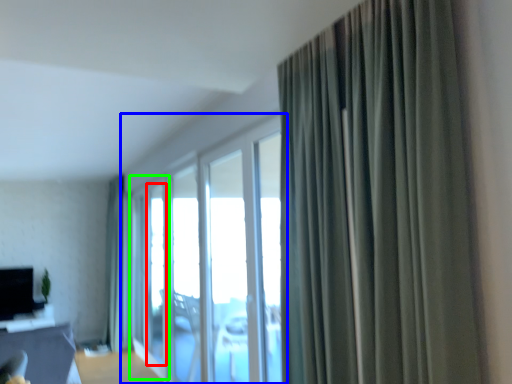
Question: Which object is positioned farthest from window screen (highlighted by a red box)? Select from window (highlighted by a blue box) and screen door (highlighted by a green box).

Choices:
 (A) window
 (B) screen door

Answer: (A)